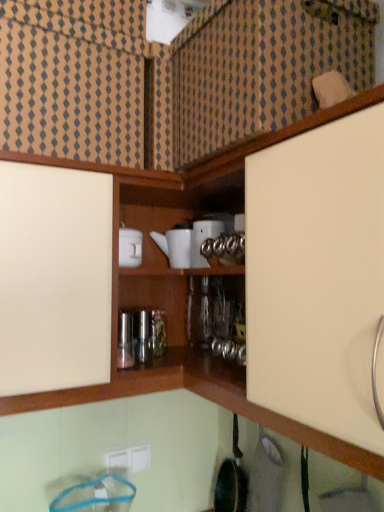
Question: Should I look upward or downward to see white glossy teapot at upper center, arranged as the second appliance when viewed from the left?

Choices:
 (A) down
 (B) up

Answer: (B)

Question: Is white plastic electric outlet at lower center taller than white glossy teapot at upper center, arranged as the second appliance when viewed from the left?

Choices:
 (A) no
 (B) yes

Answer: (A)

Question: Is white glossy teapot at upper center, arranged as the second appliance when viewed from the left, a part of white plastic electric outlet at lower center?

Choices:
 (A) yes
 (B) no

Answer: (B)

Question: From a real-world perspective, does white plastic electric outlet at lower center sit lower than white glossy teapot at upper center, arranged as the second appliance when viewed from the left?

Choices:
 (A) no
 (B) yes

Answer: (B)

Question: Is white plastic electric outlet at lower center in contact with white glossy teapot at upper center, the first appliance positioned from the right?

Choices:
 (A) no
 (B) yes

Answer: (A)

Question: Can you confirm if white plastic electric outlet at lower center is positioned to the right of white glossy teapot at upper center, arranged as the second appliance when viewed from the left?

Choices:
 (A) no
 (B) yes

Answer: (A)

Question: From a real-world perspective, is white plastic electric outlet at lower center over white glossy teapot at upper center, arranged as the second appliance when viewed from the left?

Choices:
 (A) yes
 (B) no

Answer: (B)

Question: Is white ceramic teapot at center, the 2th appliance from the right, surrounding white plastic electric outlet at lower center?

Choices:
 (A) no
 (B) yes

Answer: (A)

Question: Can you confirm if white ceramic teapot at center, the 2th appliance from the right, is bigger than white plastic electric outlet at lower center?

Choices:
 (A) yes
 (B) no

Answer: (A)

Question: Does white ceramic teapot at center, placed as the 1th appliance when sorted from left to right, have a lesser height compared to white plastic electric outlet at lower center?

Choices:
 (A) no
 (B) yes

Answer: (A)

Question: From the image's perspective, would you say white ceramic teapot at center, placed as the 1th appliance when sorted from left to right, is shown under white plastic electric outlet at lower center?

Choices:
 (A) yes
 (B) no

Answer: (B)

Question: From the image's perspective, does white ceramic teapot at center, placed as the 1th appliance when sorted from left to right, appear higher than white plastic electric outlet at lower center?

Choices:
 (A) yes
 (B) no

Answer: (A)

Question: Can you confirm if white ceramic teapot at center, the 2th appliance from the right, is taller than white plastic electric outlet at lower center?

Choices:
 (A) yes
 (B) no

Answer: (A)

Question: Is white glossy teapot at upper center, arranged as the second appliance when viewed from the left, aimed at white plastic electric outlet at lower center?

Choices:
 (A) yes
 (B) no

Answer: (B)